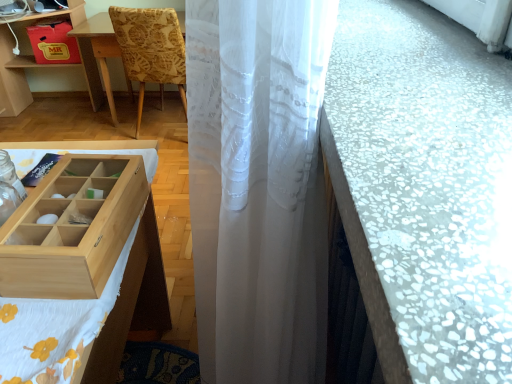
Question: From the image's perspective, is white mosaic tile counter top at right located above or below wooden table at left?

Choices:
 (A) above
 (B) below

Answer: (B)

Question: Would you say white mosaic tile counter top at right is to the left or to the right of wooden table at left in the picture?

Choices:
 (A) left
 (B) right

Answer: (B)

Question: Which of these objects is positioned closest to the white fabric at left?

Choices:
 (A) patterned fabric chair at upper left
 (B) white sheer curtain at center
 (C) light wood/wooden box at lower left
 (D) wooden table at left
 (E) white mosaic tile counter top at right

Answer: (C)

Question: Based on their relative distances, which object is nearer to the patterned fabric chair at upper left?

Choices:
 (A) matte cardboard drawer at upper left
 (B) wooden table at left
 (C) white fabric at left
 (D) light wood/wooden box at lower left
 (E) white sheer curtain at center

Answer: (B)